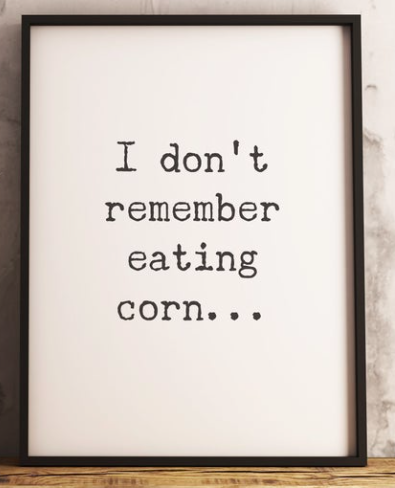
Image resolution: width=395 pixels, height=488 pixels. I want to click on wooden table, so click(331, 477).